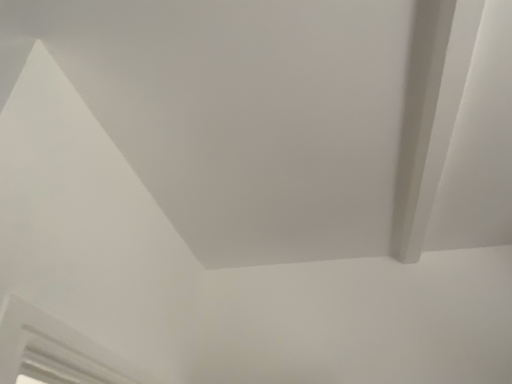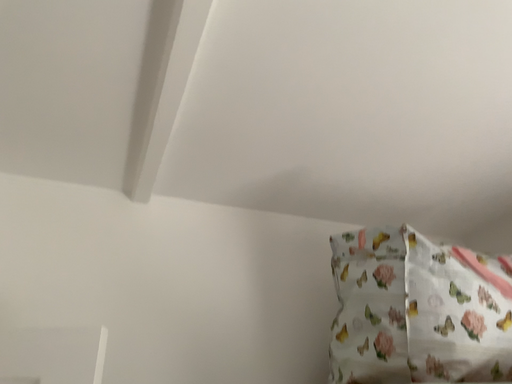
Question: Which way did the camera rotate in the video?

Choices:
 (A) rotated upward
 (B) rotated downward

Answer: (B)